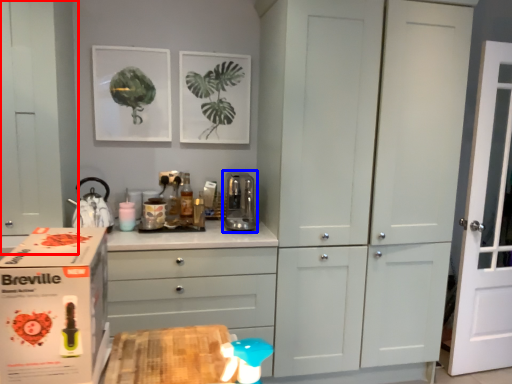
Question: Which point is further to the camera, cabinetry (highlighted by a red box) or appliance (highlighted by a blue box)?

Choices:
 (A) cabinetry
 (B) appliance

Answer: (B)